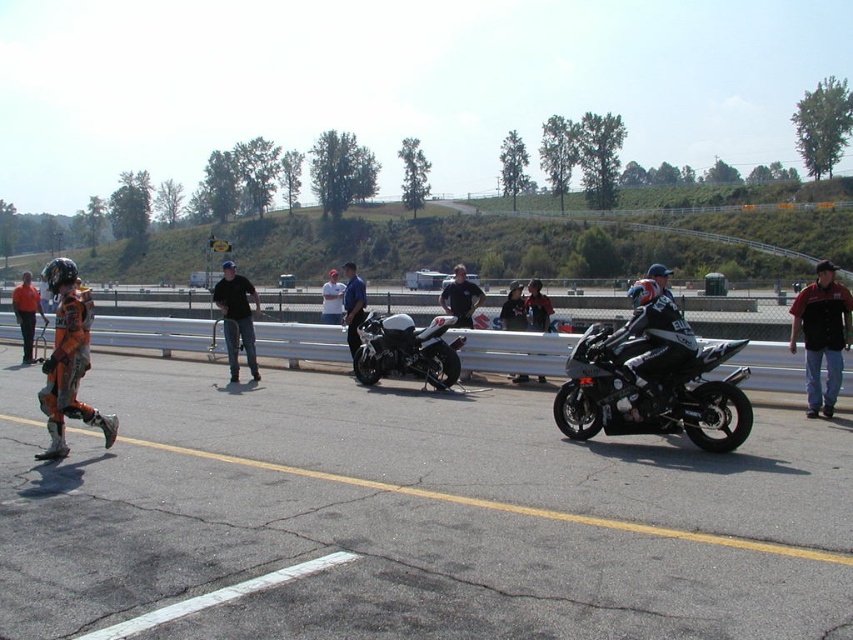
You are a spectator at the motorcycle racing event. You notice a point marked at coordinates (405, 349) on the image. What object is located at that point?

The point at coordinates (405, 349) corresponds to the white matte motorcycle at center.

You are a participant in the motorcycle racing event and need to locate your white matte motorcycle at center. According to the scene description, where exactly is it positioned?

The white matte motorcycle at center is positioned at point coordinates of [405,349].